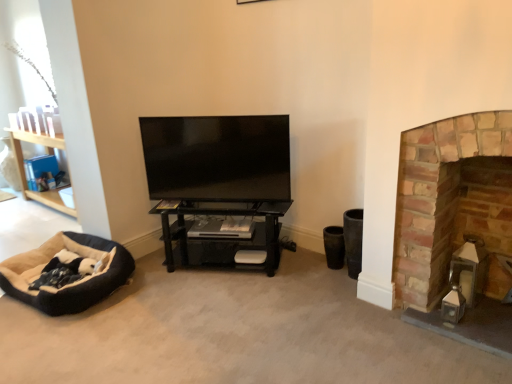
At what (x,y) coordinates should I click in order to perform the action: click on flat screen tv at center. Please return your answer as a coordinate pair (x, y). The height and width of the screenshot is (384, 512). Looking at the image, I should click on (217, 157).

Where is `brick fireplace at right`? The height and width of the screenshot is (384, 512). brick fireplace at right is located at coordinates (456, 223).

What is the approximate width of black matte shelf at center?

The width of black matte shelf at center is 23.91 inches.

Identify the location of flat screen tv at center. (217, 157).

Can you see soft beige fabric dog bed at lower left touching flat screen tv at center?

They are not placed beside each other.

How different are the orientations of soft beige fabric dog bed at lower left and flat screen tv at center in degrees?

The angle between the facing direction of soft beige fabric dog bed at lower left and the facing direction of flat screen tv at center is 23.1 degrees.

Between point (108, 265) and point (289, 179), which one is positioned behind?

Point (289, 179)

Would you say soft beige fabric dog bed at lower left is outside flat screen tv at center?

Yes, soft beige fabric dog bed at lower left is not within flat screen tv at center.

Does black matte shelf at center have a greater width compared to flat screen tv at center?

Yes.

Can you confirm if black matte shelf at center is shorter than flat screen tv at center?

Indeed, black matte shelf at center has a lesser height compared to flat screen tv at center.

Is black matte shelf at center facing away from flat screen tv at center?

black matte shelf at center is not turned away from flat screen tv at center.

In the scene shown: Is black matte shelf at center at the right side of flat screen tv at center?

Correct, you'll find black matte shelf at center to the right of flat screen tv at center.

Looking at this image, which point is more forward, (221, 182) or (505, 326)?

The point (505, 326) is closer.

Is flat screen tv at center closer to the viewer compared to brick fireplace at right?

No, it is behind brick fireplace at right.

From the image's perspective, is flat screen tv at center on top of brick fireplace at right?

Yes, from the image's perspective, flat screen tv at center is over brick fireplace at right.

Identify the location of shelf behind the soft beige fabric dog bed at lower left. This screenshot has width=512, height=384. (225, 231).

Is soft beige fabric dog bed at lower left wider or thinner than black matte shelf at center?

Considering their sizes, soft beige fabric dog bed at lower left looks broader than black matte shelf at center.

Visually, is soft beige fabric dog bed at lower left positioned to the left or to the right of black matte shelf at center?

soft beige fabric dog bed at lower left is to the left of black matte shelf at center.

Considering the sizes of objects soft beige fabric dog bed at lower left and black matte shelf at center in the image provided, who is shorter, soft beige fabric dog bed at lower left or black matte shelf at center?

Standing shorter between the two is soft beige fabric dog bed at lower left.

Find the location of a particular element. fireplace in front of the black matte shelf at center is located at coordinates (456, 223).

From the picture: Does brick fireplace at right touch black matte shelf at center?

No, brick fireplace at right is not next to black matte shelf at center.

Is brick fireplace at right looking in the opposite direction of black matte shelf at center?

brick fireplace at right is not turned away from black matte shelf at center.

Between brick fireplace at right and black matte shelf at center, which one appears on the right side from the viewer's perspective?

From the viewer's perspective, brick fireplace at right appears more on the right side.

Is brick fireplace at right placed right next to soft beige fabric dog bed at lower left?

No, brick fireplace at right is not next to soft beige fabric dog bed at lower left.

Can you confirm if brick fireplace at right is shorter than soft beige fabric dog bed at lower left?

No, brick fireplace at right is not shorter than soft beige fabric dog bed at lower left.

In terms of width, does brick fireplace at right look wider or thinner when compared to soft beige fabric dog bed at lower left?

In the image, brick fireplace at right appears to be more narrow than soft beige fabric dog bed at lower left.

What's the angular difference between brick fireplace at right and soft beige fabric dog bed at lower left's facing directions?

They differ by 8.31 degrees in their facing directions.

From a real-world perspective, does brick fireplace at right stand above flat screen tv at center?

No, from a real-world perspective, brick fireplace at right is not above flat screen tv at center.

Which is more to the right, brick fireplace at right or flat screen tv at center?

brick fireplace at right.

I want to click on television above the brick fireplace at right (from the image's perspective), so click(x=217, y=157).

Locate an element on the screen. This screenshot has width=512, height=384. dog bed in front of the flat screen tv at center is located at coordinates (73, 283).

Find the location of a particular element. Image resolution: width=512 pixels, height=384 pixels. shelf that appears behind the flat screen tv at center is located at coordinates (225, 231).

Estimate the real-world distances between objects in this image. Which object is closer to black matte shelf at center, brick fireplace at right or flat screen tv at center?

flat screen tv at center is closer to black matte shelf at center.

Estimate the real-world distances between objects in this image. Which object is closer to flat screen tv at center, soft beige fabric dog bed at lower left or brick fireplace at right?

soft beige fabric dog bed at lower left is closer to flat screen tv at center.

When comparing their distances from brick fireplace at right, does black matte shelf at center or flat screen tv at center seem further?

Based on the image, flat screen tv at center appears to be further to brick fireplace at right.

From the image, which object appears to be farther from soft beige fabric dog bed at lower left, brick fireplace at right or flat screen tv at center?

Based on the image, brick fireplace at right appears to be further to soft beige fabric dog bed at lower left.

Estimate the real-world distances between objects in this image. Which object is further from brick fireplace at right, flat screen tv at center or black matte shelf at center?

flat screen tv at center is positioned further to the anchor brick fireplace at right.

Based on their spatial positions, is black matte shelf at center or brick fireplace at right further from soft beige fabric dog bed at lower left?

brick fireplace at right is positioned further to the anchor soft beige fabric dog bed at lower left.

Which object lies further to the anchor point brick fireplace at right, flat screen tv at center or soft beige fabric dog bed at lower left?

The object further to brick fireplace at right is soft beige fabric dog bed at lower left.

From the image, which object appears to be nearer to brick fireplace at right, soft beige fabric dog bed at lower left or black matte shelf at center?

black matte shelf at center lies closer to brick fireplace at right than the other object.

At what (x,y) coordinates should I click in order to perform the action: click on television situated between soft beige fabric dog bed at lower left and black matte shelf at center from left to right. Please return your answer as a coordinate pair (x, y). This screenshot has width=512, height=384. Looking at the image, I should click on (217, 157).

At what (x,y) coordinates should I click in order to perform the action: click on television between soft beige fabric dog bed at lower left and brick fireplace at right. Please return your answer as a coordinate pair (x, y). This screenshot has width=512, height=384. Looking at the image, I should click on (217, 157).

What are the coordinates of `shelf between flat screen tv at center and brick fireplace at right in the horizontal direction` in the screenshot? It's located at (225, 231).

In order to click on shelf situated between soft beige fabric dog bed at lower left and brick fireplace at right from left to right in this screenshot , I will do `click(225, 231)`.